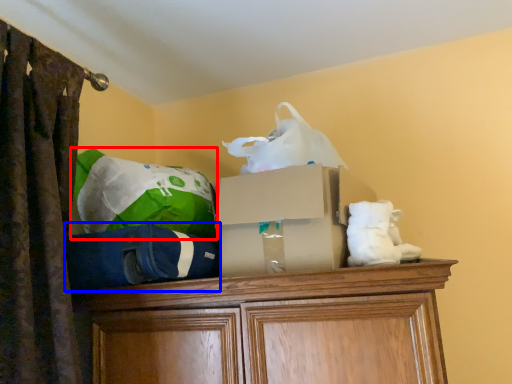
Question: Which of the following is the farthest to the observer, bean bag chair (highlighted by a red box) or bean bag chair (highlighted by a blue box)?

Choices:
 (A) bean bag chair
 (B) bean bag chair

Answer: (A)